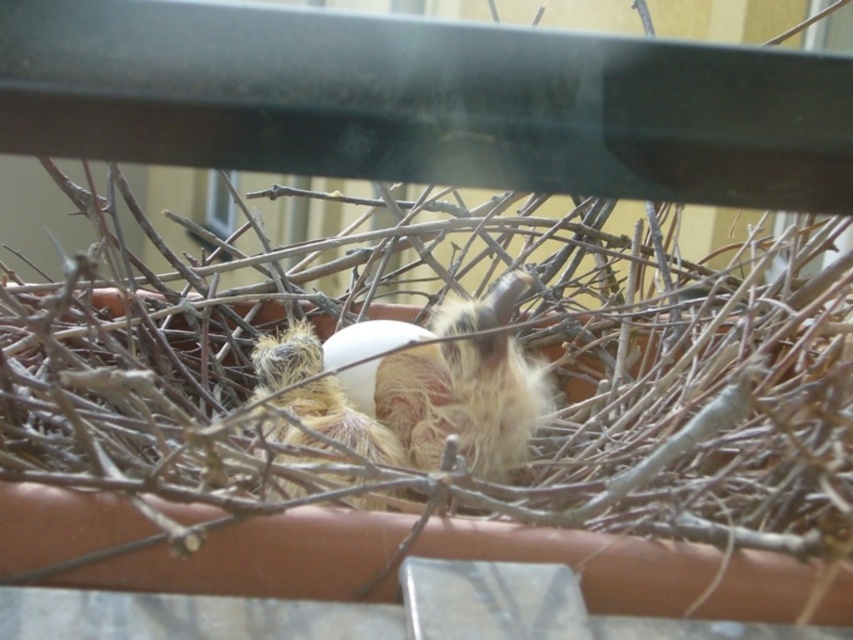
You are holding a measuring tape and want to measure the distance from your eyes to the point marked as point (469, 435) in the image. What is the approximate distance in inches?

The distance between point (469, 435) and the camera is 30.14 inches, so the approximate distance is 30.14 inches.

You are a wildlife photographer observing the bird nest in the terracotta pot. You notice two fuzzy downy birds inside. Which one is taller, the fluffy downy bird at center or the fuzzy downy bird at center?

The fluffy downy bird at center is much taller than the fuzzy downy bird at center.

You are observing a bird nest in a terracotta pot. You notice two birds inside the nest. One is labeled as the fluffy downy bird at center and the other as the fuzzy downy bird at center. Which of these two birds is bigger?

The fluffy downy bird at center is larger in size compared to the fuzzy downy bird at center.